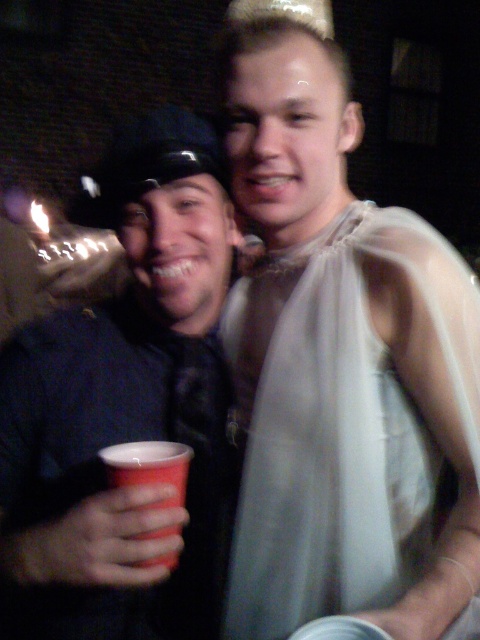
Who is shorter, sheer white dress at right or red plastic cup at lower left?

Standing shorter between the two is red plastic cup at lower left.

How much distance is there between sheer white dress at right and red plastic cup at lower left?

A distance of 9.97 inches exists between sheer white dress at right and red plastic cup at lower left.

Is point (352, 538) positioned behind point (182, 449)?

Yes, point (352, 538) is farther from viewer.

At what (x,y) coordinates should I click in order to perform the action: click on sheer white dress at right. Please return your answer as a coordinate pair (x, y). Image resolution: width=480 pixels, height=640 pixels. Looking at the image, I should click on (338, 422).

Does matte black cup at left appear over red plastic cup at lower left?

Yes, matte black cup at left is above red plastic cup at lower left.

Can you confirm if matte black cup at left is smaller than red plastic cup at lower left?

Incorrect, matte black cup at left is not smaller in size than red plastic cup at lower left.

Does point (105, 444) lie behind point (126, 464)?

Yes.

At what (x,y) coordinates should I click in order to perform the action: click on matte black cup at left. Please return your answer as a coordinate pair (x, y). This screenshot has width=480, height=640. Looking at the image, I should click on (126, 410).

Locate an element on the screen. matte black cup at left is located at coordinates (126, 410).

The image size is (480, 640). Identify the location of matte black cup at left. (126, 410).